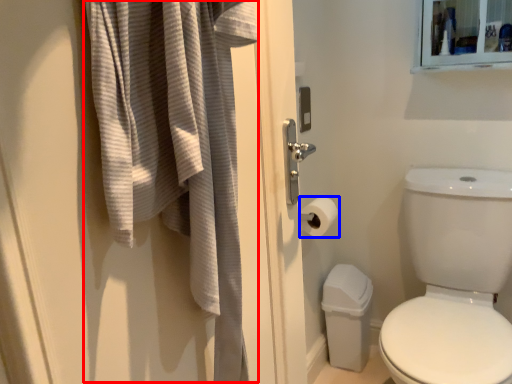
Question: Which of the following is the closest to the observer, bath towel (highlighted by a red box) or toilet paper (highlighted by a blue box)?

Choices:
 (A) bath towel
 (B) toilet paper

Answer: (A)